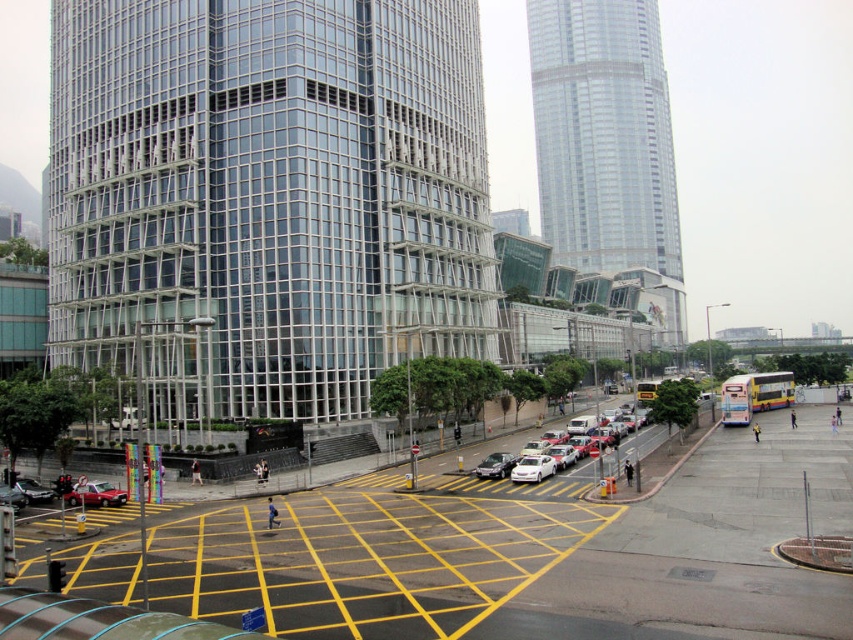
You are standing at the crosswalk and want to take a photo that includes both point (62, 198) and point (601, 65). Which point will appear larger in your photo?

Point (62, 198) will appear larger in your photo because it is closer to the camera than point (601, 65).

You are standing at the crosswalk marked with bright yellow lines in the foreground of the urban scene. You notice a point labeled at coordinates (602, 134). What object does this point indicate?

The point labeled at coordinates (602, 134) marks the glassy silver skyscraper at upper right.

You are a pedestrian standing at the crosswalk marked with bright yellow lines. You need to walk to the glassy silver skyscraper at upper right. Which direction should you head from your current position relative to the shiny black sedan at lower left?

You should head to the right of the shiny black sedan at lower left because the glassy silver skyscraper at upper right is located to the right of it.